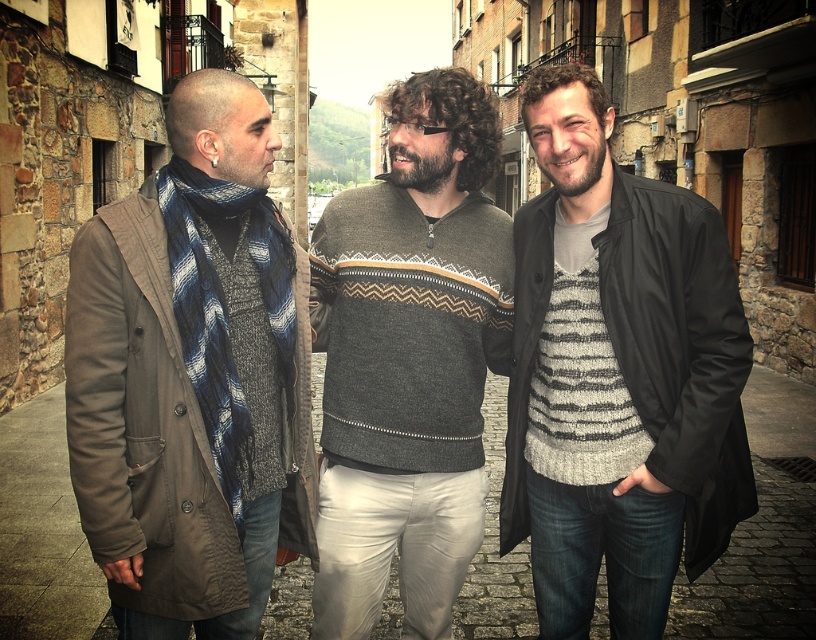
You are a fashion designer observing two sweaters in the image. The striped knit sweater at center and the dark gray sweater at center. Which one is shorter in length?

The striped knit sweater at center is shorter than the dark gray sweater at center.

You are a fashion designer observing two people in the image. The first person wears a knitted wool sweater at left and the second wears a striped knit sweater at center. Which sweater has a greater width?

The striped knit sweater at center has a greater width than the knitted wool sweater at left.